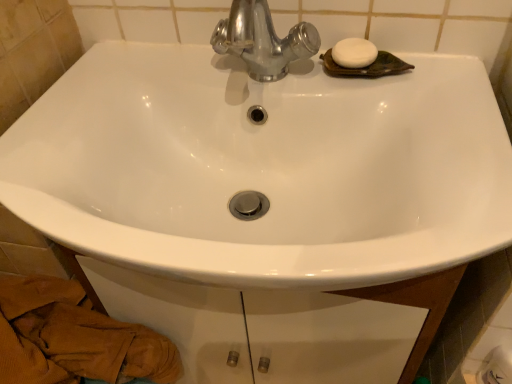
Question: Should I look upward or downward to see white matte soap at upper right?

Choices:
 (A) down
 (B) up

Answer: (B)

Question: Is white glossy toilet paper at lower right looking in the opposite direction of white matte soap at upper right?

Choices:
 (A) yes
 (B) no

Answer: (B)

Question: Is white glossy toilet paper at lower right further to the viewer compared to white matte soap at upper right?

Choices:
 (A) no
 (B) yes

Answer: (A)

Question: Is white glossy toilet paper at lower right oriented towards white matte soap at upper right?

Choices:
 (A) no
 (B) yes

Answer: (A)

Question: From a real-world perspective, is white glossy toilet paper at lower right over white matte soap at upper right?

Choices:
 (A) no
 (B) yes

Answer: (A)

Question: Considering the relative sizes of white glossy toilet paper at lower right and white matte soap at upper right in the image provided, is white glossy toilet paper at lower right shorter than white matte soap at upper right?

Choices:
 (A) yes
 (B) no

Answer: (B)

Question: Considering the relative positions of white glossy toilet paper at lower right and white matte soap at upper right in the image provided, is white glossy toilet paper at lower right to the right of white matte soap at upper right from the viewer's perspective?

Choices:
 (A) no
 (B) yes

Answer: (B)

Question: From a real-world perspective, is white matte soap at upper right physically below brown textured towel at lower left?

Choices:
 (A) yes
 (B) no

Answer: (B)

Question: From a real-world perspective, is white matte soap at upper right physically above brown textured towel at lower left?

Choices:
 (A) yes
 (B) no

Answer: (A)

Question: Is white matte soap at upper right shorter than brown textured towel at lower left?

Choices:
 (A) yes
 (B) no

Answer: (A)

Question: Is white matte soap at upper right behind brown textured towel at lower left?

Choices:
 (A) no
 (B) yes

Answer: (B)

Question: Is white matte soap at upper right turned away from brown textured towel at lower left?

Choices:
 (A) no
 (B) yes

Answer: (A)

Question: Is the position of white matte soap at upper right less distant than that of brown textured towel at lower left?

Choices:
 (A) no
 (B) yes

Answer: (A)

Question: Is white glossy toilet paper at lower right surrounded by white matte soap at upper right?

Choices:
 (A) no
 (B) yes

Answer: (A)